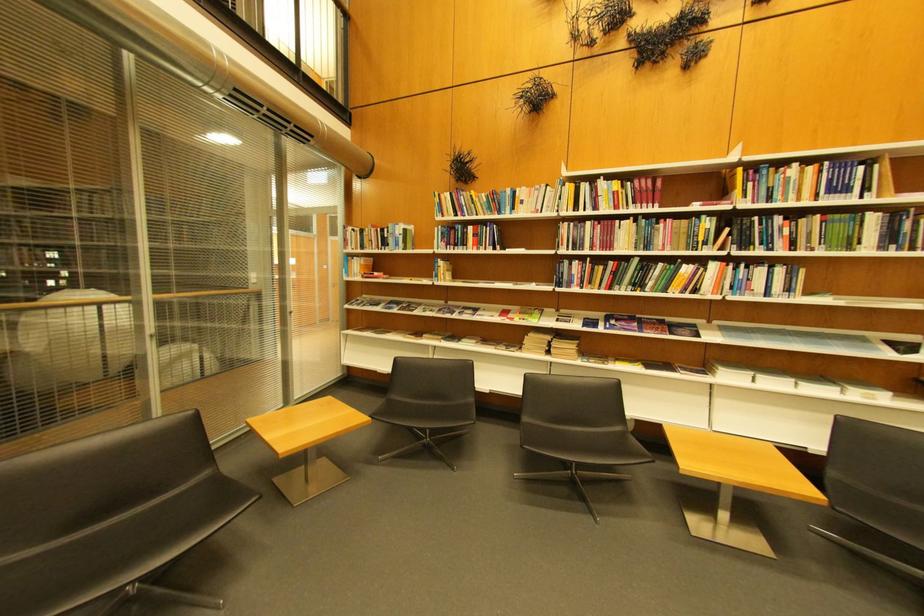
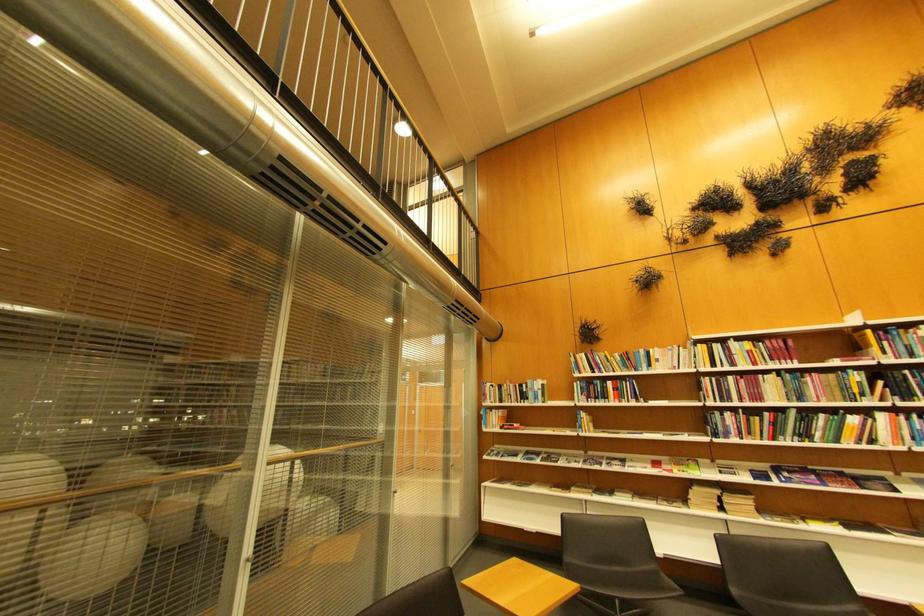
The point at (647, 262) is marked in the first image. Where is the corresponding point in the second image?

(804, 413)